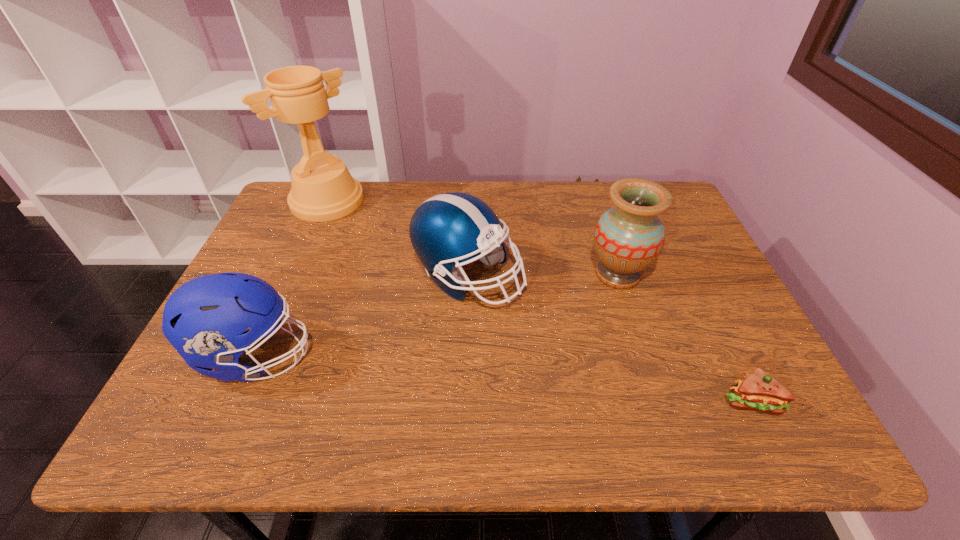
Locate an element on the screen. award is located at coordinates tap(323, 189).

Image resolution: width=960 pixels, height=540 pixels. What are the coordinates of `the tallest object` in the screenshot? It's located at (323, 189).

Identify the location of vase. The height and width of the screenshot is (540, 960). (628, 238).

Identify the location of the farther football helmet. This screenshot has width=960, height=540. (447, 229).

Where is `the third object from right to left`? The height and width of the screenshot is (540, 960). the third object from right to left is located at coordinates (447, 229).

Where is `the nearer football helmet`? This screenshot has width=960, height=540. the nearer football helmet is located at coordinates (204, 319).

Locate an element on the screen. This screenshot has height=540, width=960. the rightmost object is located at coordinates (759, 391).

Locate an element on the screen. This screenshot has width=960, height=540. sandwich is located at coordinates (759, 391).

At what (x,y) coordinates should I click in order to perform the action: click on free location located 0.210m on the right of the farthest object. Please return your answer as a coordinate pair (x, y). The image size is (960, 540). Looking at the image, I should click on (428, 201).

This screenshot has height=540, width=960. I want to click on vacant region located 0.370m on the front of the vase, so point(670,437).